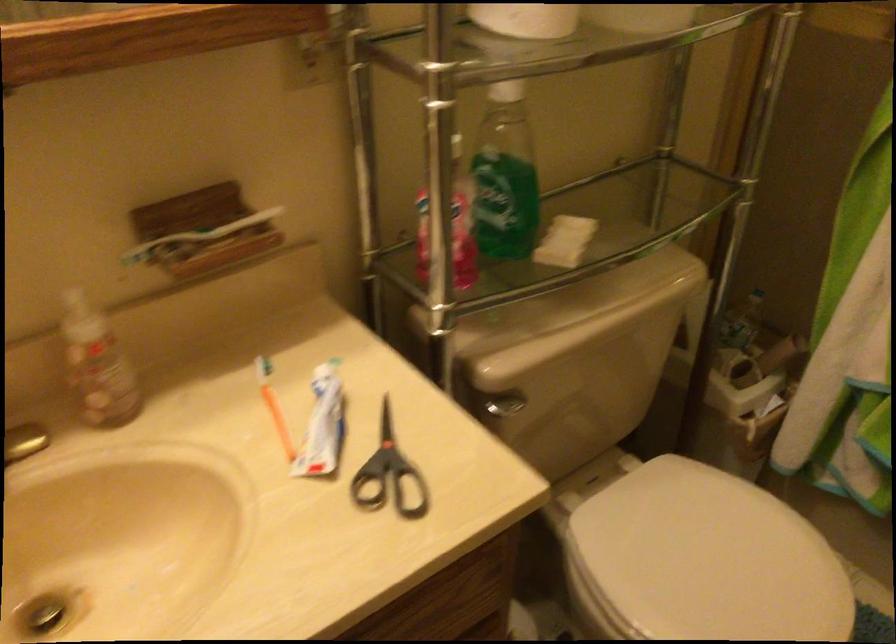
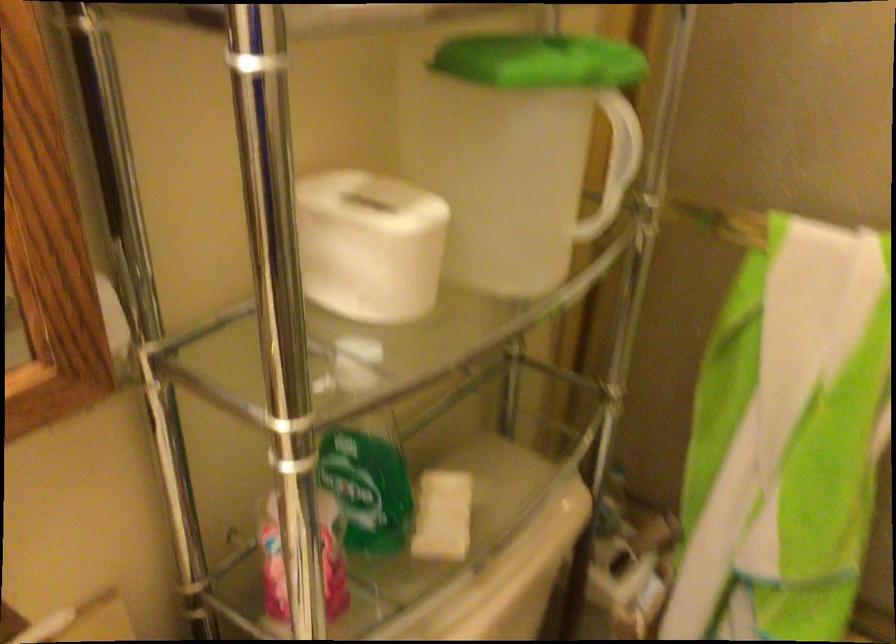
The point at [501,198] is marked in the first image. Where is the corresponding point in the second image?

(367, 489)